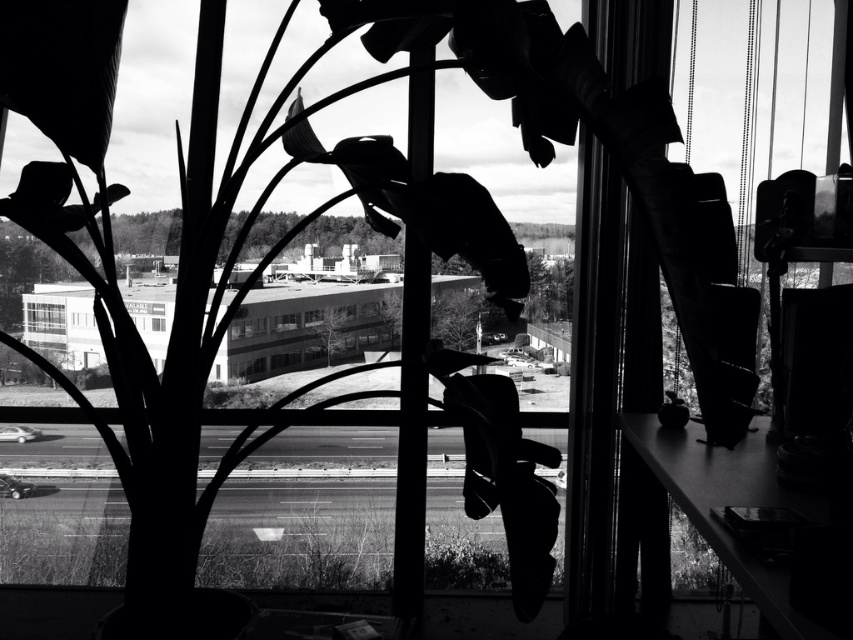
Question: Can you confirm if clear glass window at center is positioned above transparent glass window at center?

Choices:
 (A) yes
 (B) no

Answer: (A)

Question: Which object is closer to the camera taking this photo?

Choices:
 (A) clear glass window at center
 (B) transparent glass window at center

Answer: (A)

Question: Is clear glass window at center to the right of transparent glass window at center from the viewer's perspective?

Choices:
 (A) yes
 (B) no

Answer: (B)

Question: Which of the following is the closest to the observer?

Choices:
 (A) (161, 330)
 (B) (38, 317)

Answer: (B)

Question: Does clear glass window at center have a lesser width compared to transparent glass window at center?

Choices:
 (A) yes
 (B) no

Answer: (B)